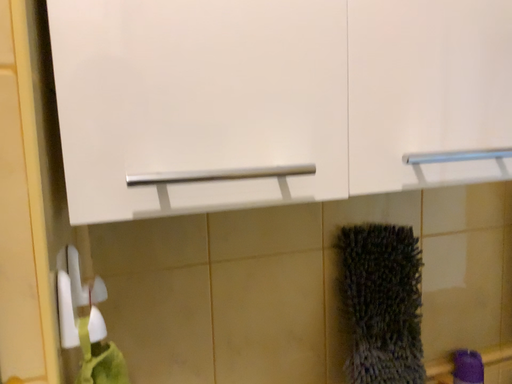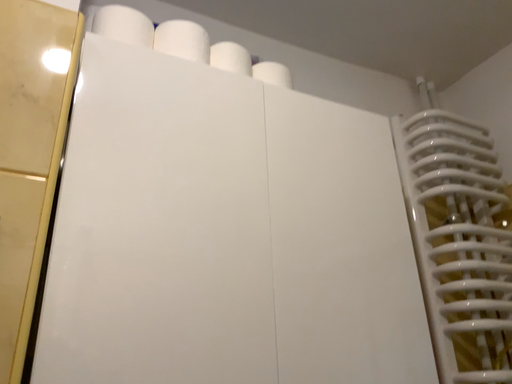
Question: How did the camera likely rotate when shooting the video?

Choices:
 (A) rotated downward
 (B) rotated upward

Answer: (B)